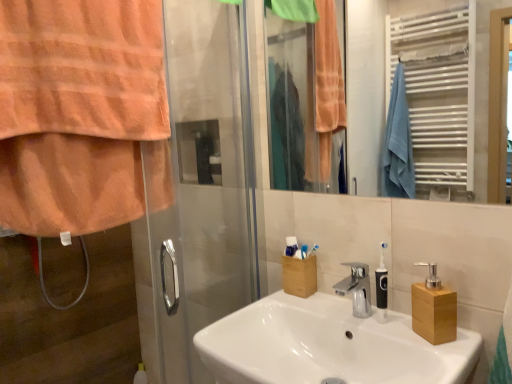
The width and height of the screenshot is (512, 384). What do you see at coordinates (291, 246) in the screenshot?
I see `white matte toothbrush holder at center` at bounding box center [291, 246].

What is the approximate height of wooden block at right, placed as the first soap dispenser when sorted from left to right?

wooden block at right, placed as the first soap dispenser when sorted from left to right, is 22.38 centimeters in height.

The image size is (512, 384). Describe the element at coordinates (382, 288) in the screenshot. I see `wooden block at right, placed as the first soap dispenser when sorted from left to right` at that location.

This screenshot has height=384, width=512. What do you see at coordinates (434, 309) in the screenshot? I see `wooden block soap dispenser at right, the 1th soap dispenser when ordered from right to left` at bounding box center [434, 309].

The image size is (512, 384). Describe the element at coordinates (384, 97) in the screenshot. I see `metallic silver towel rack at upper right` at that location.

The image size is (512, 384). What do you see at coordinates (328, 345) in the screenshot? I see `white ceramic sink at center` at bounding box center [328, 345].

Find the location of a particular element. orange towel at left is located at coordinates (81, 114).

The image size is (512, 384). I want to click on white matte toothbrush holder at center, so click(x=291, y=246).

Considering the sizes of orange towel at left and white ceramic sink at center in the image, is orange towel at left taller or shorter than white ceramic sink at center?

orange towel at left is taller than white ceramic sink at center.

Is orange towel at left next to white ceramic sink at center and touching it?

orange towel at left and white ceramic sink at center are not in contact.

Is white ceramic sink at center at the back of orange towel at left?

orange towel at left does not have its back to white ceramic sink at center.

Can you confirm if orange towel at left is thinner than white ceramic sink at center?

Correct, the width of orange towel at left is less than that of white ceramic sink at center.

Is metallic silver towel rack at upper right taller than orange towel at left?

No, metallic silver towel rack at upper right is not taller than orange towel at left.

Looking at this image, could orange towel at left be considered to be inside metallic silver towel rack at upper right?

Actually, orange towel at left is outside metallic silver towel rack at upper right.

From a real-world perspective, which object rests below the other?

In real-world perspective, orange towel at left is lower.

Is metallic silver towel rack at upper right oriented towards orange towel at left?

Yes, metallic silver towel rack at upper right is oriented towards orange towel at left.

Consider the image. Could you tell me if white matte toothbrush holder at center is facing orange towel at left?

No, white matte toothbrush holder at center does not turn towards orange towel at left.

Between white matte toothbrush holder at center and orange towel at left, which one has less height?

Standing shorter between the two is white matte toothbrush holder at center.

Does white matte toothbrush holder at center have a lesser width compared to orange towel at left?

Indeed, white matte toothbrush holder at center has a lesser width compared to orange towel at left.

Consider the image. Is white matte toothbrush holder at center positioned far away from orange towel at left?

Actually, white matte toothbrush holder at center and orange towel at left are a little close together.

From the picture: Can you confirm if wooden block soap dispenser at right, the second soap dispenser from the left, is thinner than wooden block at right, placed as the 2th soap dispenser when sorted from right to left?

Incorrect, the width of wooden block soap dispenser at right, the second soap dispenser from the left, is not less than that of wooden block at right, placed as the 2th soap dispenser when sorted from right to left.

Could you tell me if wooden block soap dispenser at right, the second soap dispenser from the left, is facing wooden block at right, placed as the 2th soap dispenser when sorted from right to left?

No.

Is wooden block soap dispenser at right, the 1th soap dispenser when ordered from right to left, surrounding wooden block at right, placed as the 2th soap dispenser when sorted from right to left?

Result: That's incorrect, wooden block at right, placed as the 2th soap dispenser when sorted from right to left, is not inside wooden block soap dispenser at right, the 1th soap dispenser when ordered from right to left.

Considering the sizes of metallic silver towel rack at upper right and white ceramic sink at center in the image, is metallic silver towel rack at upper right bigger or smaller than white ceramic sink at center?

In the image, metallic silver towel rack at upper right appears to be smaller than white ceramic sink at center.

What's the angular difference between metallic silver towel rack at upper right and white ceramic sink at center's facing directions?

They differ by 0.192 degrees in their facing directions.

Can you confirm if metallic silver towel rack at upper right is shorter than white ceramic sink at center?

No.

Is wooden block at right, placed as the first soap dispenser when sorted from left to right, inside the boundaries of metallic silver towel rack at upper right, or outside?

The correct answer is: outside.

Considering the sizes of wooden block at right, placed as the 2th soap dispenser when sorted from right to left, and metallic silver towel rack at upper right in the image, is wooden block at right, placed as the 2th soap dispenser when sorted from right to left, wider or thinner than metallic silver towel rack at upper right?

wooden block at right, placed as the 2th soap dispenser when sorted from right to left, is wider than metallic silver towel rack at upper right.

Considering the sizes of objects wooden block at right, placed as the first soap dispenser when sorted from left to right, and metallic silver towel rack at upper right in the image provided, who is taller, wooden block at right, placed as the first soap dispenser when sorted from left to right, or metallic silver towel rack at upper right?

metallic silver towel rack at upper right is taller.

Looking at this image, are wooden block at right, placed as the first soap dispenser when sorted from left to right, and metallic silver towel rack at upper right located far from each other?

wooden block at right, placed as the first soap dispenser when sorted from left to right, is far away from metallic silver towel rack at upper right.

Is the depth of white matte toothbrush holder at center less than that of white ceramic sink at center?

No, white matte toothbrush holder at center is behind white ceramic sink at center.

Where is `toiletry above the white ceramic sink at center (from a real-world perspective)`? This screenshot has width=512, height=384. toiletry above the white ceramic sink at center (from a real-world perspective) is located at coordinates (291, 246).

In the scene shown: What's the angular difference between white matte toothbrush holder at center and white ceramic sink at center's facing directions?

They differ by 40.8 degrees in their facing directions.

Which point is more distant from viewer, (294,246) or (333,354)?

The point (294,246) is farther.

Where is `sink in front of the orange towel at left`? sink in front of the orange towel at left is located at coordinates (328, 345).

Identify the location of curtain located on the left of metallic silver towel rack at upper right. The height and width of the screenshot is (384, 512). (81, 114).

Estimate the real-world distances between objects in this image. Which object is further from wooden block soap dispenser at right, the 1th soap dispenser when ordered from right to left, white matte toothbrush holder at center or wooden block at right, placed as the 2th soap dispenser when sorted from right to left?

white matte toothbrush holder at center lies further to wooden block soap dispenser at right, the 1th soap dispenser when ordered from right to left, than the other object.

From the image, which object appears to be nearer to orange towel at left, wooden block soap dispenser at right, the second soap dispenser from the left, or wooden block at right, placed as the first soap dispenser when sorted from left to right?

Based on the image, wooden block at right, placed as the first soap dispenser when sorted from left to right, appears to be nearer to orange towel at left.

From the image, which object appears to be farther from white ceramic sink at center, white matte toothbrush holder at center or wooden block soap dispenser at right, the 1th soap dispenser when ordered from right to left?

The object further to white ceramic sink at center is white matte toothbrush holder at center.

Consider the image. Considering their positions, is metallic silver towel rack at upper right positioned closer to white ceramic sink at center than wooden block at right, placed as the 2th soap dispenser when sorted from right to left?

Based on the image, wooden block at right, placed as the 2th soap dispenser when sorted from right to left, appears to be nearer to white ceramic sink at center.

Looking at the image, which one is located closer to metallic silver towel rack at upper right, orange towel at left or white ceramic sink at center?

Based on the image, white ceramic sink at center appears to be nearer to metallic silver towel rack at upper right.

Considering their positions, is orange towel at left positioned further to white ceramic sink at center than wooden block soap dispenser at right, the second soap dispenser from the left?

Among the two, orange towel at left is located further to white ceramic sink at center.

Considering their positions, is white matte toothbrush holder at center positioned closer to wooden block soap dispenser at right, the second soap dispenser from the left, than orange towel at left?

white matte toothbrush holder at center is positioned closer to the anchor wooden block soap dispenser at right, the second soap dispenser from the left.

Considering their positions, is white ceramic sink at center positioned further to orange towel at left than wooden block soap dispenser at right, the second soap dispenser from the left?

Among the two, wooden block soap dispenser at right, the second soap dispenser from the left, is located further to orange towel at left.

Identify the location of soap dispenser between white ceramic sink at center and wooden block at right, placed as the first soap dispenser when sorted from left to right, along the z-axis. This screenshot has width=512, height=384. (434, 309).

Find the location of a particular element. sink located between orange towel at left and wooden block at right, placed as the 2th soap dispenser when sorted from right to left, in the left-right direction is located at coordinates (328, 345).

The width and height of the screenshot is (512, 384). In order to click on mirror located between white ceramic sink at center and white matte toothbrush holder at center in the depth direction in this screenshot , I will do `click(384, 97)`.

This screenshot has height=384, width=512. Find the location of `mirror between orange towel at left and wooden block at right, placed as the first soap dispenser when sorted from left to right, in the horizontal direction`. mirror between orange towel at left and wooden block at right, placed as the first soap dispenser when sorted from left to right, in the horizontal direction is located at coordinates (384, 97).